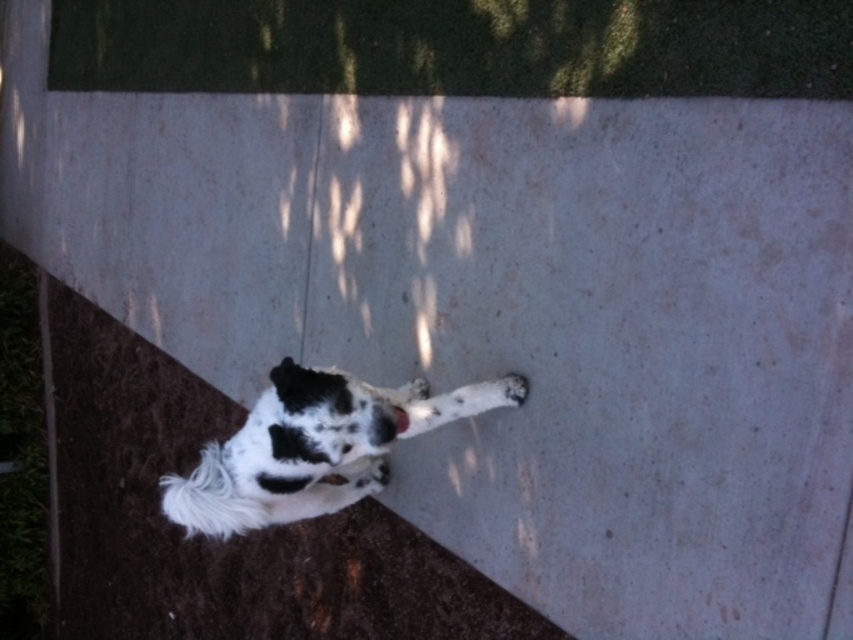
You are a photographer trying to capture the white fur dog at lower left and the white fur paw at lower right in a single frame. Based on their sizes, which one should you focus on to ensure both fit in the frame without cropping?

The white fur dog at lower left is larger in size than the white fur paw at lower right, so you should focus on capturing the white fur dog at lower left first to ensure both fit in the frame without cropping.

You are standing at the origin point in the image. The white fur dog at lower left is at coordinates 0.698 on the x and 0.362 on the y. If you want to walk directly to the dog, which direction should you move in terms of x and y coordinates?

To reach the white fur dog at lower left located at coordinates x 0.698 and y 0.362, you should move in the positive x and positive y direction since both coordinates are greater than zero.

You are a photographer trying to capture the white fur dog at lower left and the white fur paw at lower right in the same frame. Which object should you focus on first if you want to ensure both are in focus?

The white fur dog at lower left is positioned on the left side of white fur paw at lower right, so you should focus on the white fur dog at lower left first to ensure both are in focus.